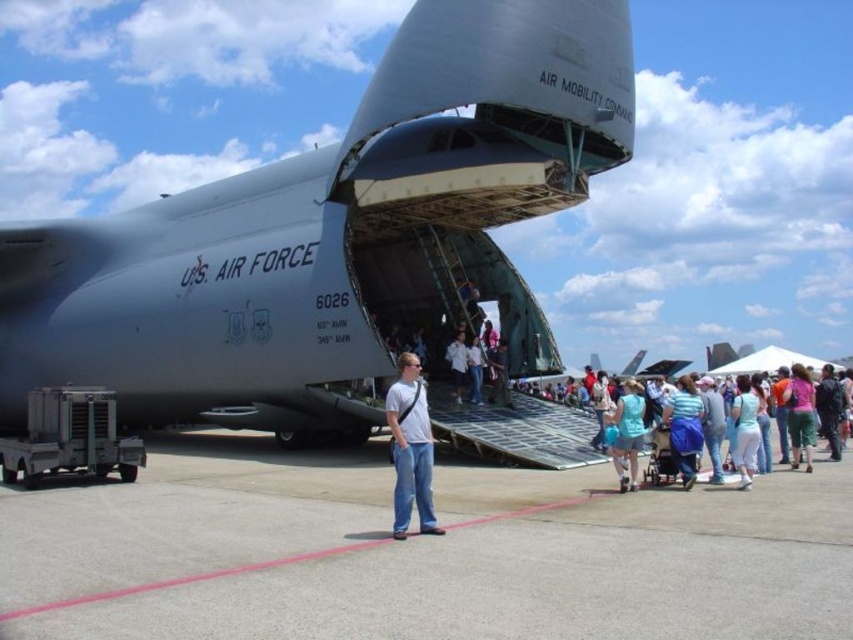
Describe the element at coordinates (410, 449) in the screenshot. I see `white matte t-shirt at center` at that location.

Measure the distance from white matte t-shirt at center to white cotton shirt at center.

white matte t-shirt at center and white cotton shirt at center are 14.79 meters apart.

Who is more forward, (421, 442) or (453, 390)?

Point (421, 442)

Locate an element on the screen. Image resolution: width=853 pixels, height=640 pixels. white matte t-shirt at center is located at coordinates (410, 449).

Can you confirm if matte gray airplane at center is positioned to the right of gray asphalt tarmac at center?

In fact, matte gray airplane at center is to the left of gray asphalt tarmac at center.

Does matte gray airplane at center appear over gray asphalt tarmac at center?

Yes.

Does point (33, 358) come behind point (107, 557)?

Yes, point (33, 358) is behind point (107, 557).

The height and width of the screenshot is (640, 853). I want to click on matte gray airplane at center, so click(x=334, y=234).

Does blue fabric bag at lower right have a smaller size compared to white cotton shirt at center?

No, blue fabric bag at lower right is not smaller than white cotton shirt at center.

I want to click on blue fabric bag at lower right, so click(683, 428).